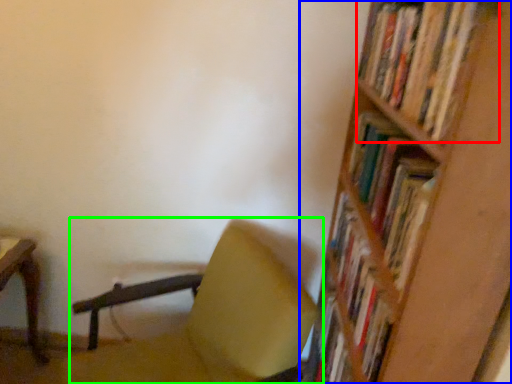
Question: Considering the real-world distances, which object is closest to book (highlighted by a red box)? shelf (highlighted by a blue box) or chair (highlighted by a green box).

Choices:
 (A) shelf
 (B) chair

Answer: (A)